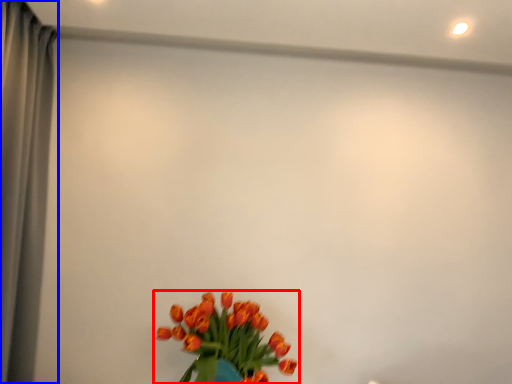
Question: Which point is further to the camera, flower (highlighted by a red box) or curtain (highlighted by a blue box)?

Choices:
 (A) flower
 (B) curtain

Answer: (A)